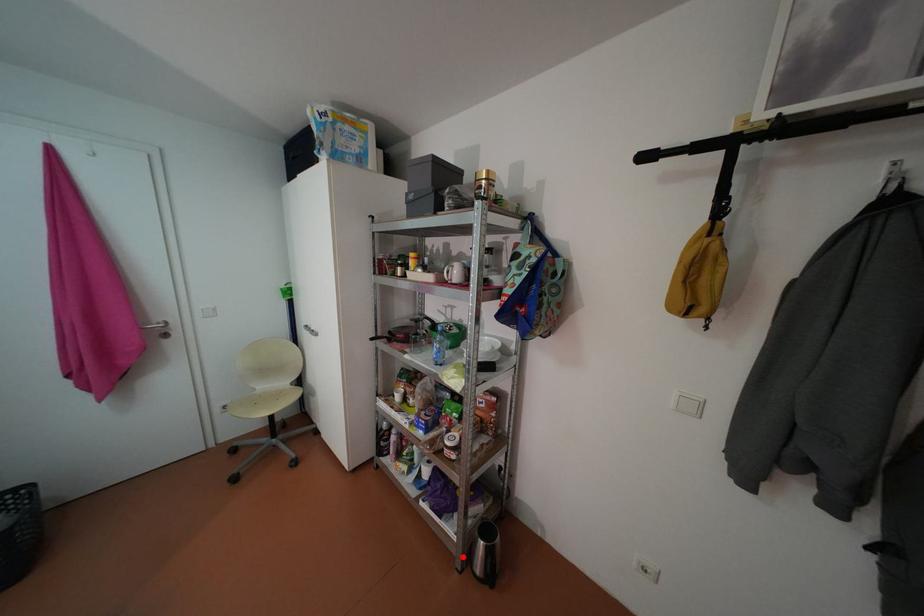
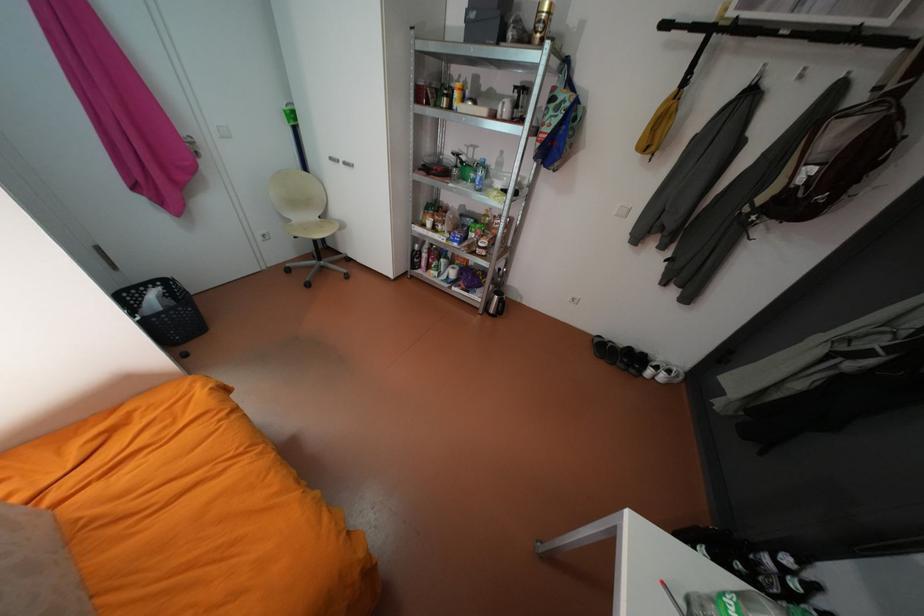
Locate, in the second image, the point that corresponds to the highlighted location in the first image.

(487, 308)